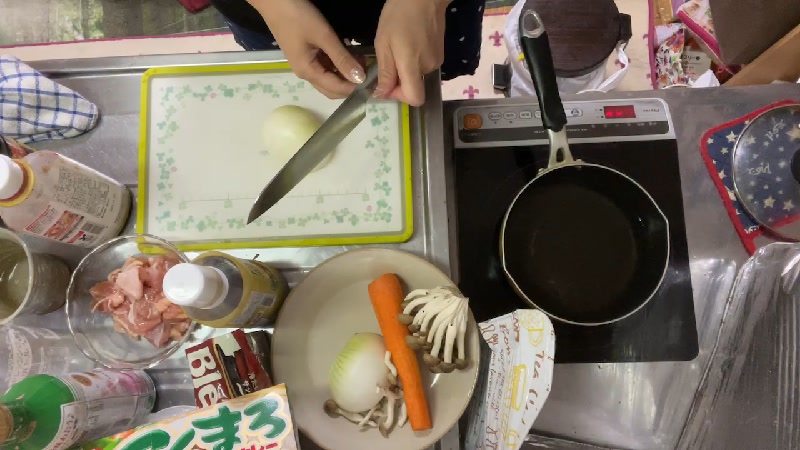
You are a GUI agent. You are given a task and a screenshot of the screen. Output one action in this format:
    pyautogui.click(x=<x>, y=<y>)
    Task: Click on the heating surface
    
    Given the screenshot: What is the action you would take?
    pos(478,211)